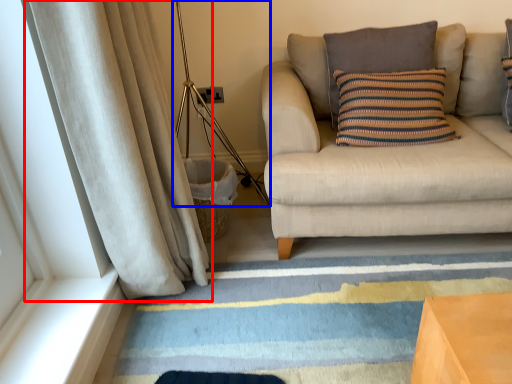
Question: Which point is further to the camera, curtain (highlighted by a red box) or lamp (highlighted by a blue box)?

Choices:
 (A) curtain
 (B) lamp

Answer: (B)